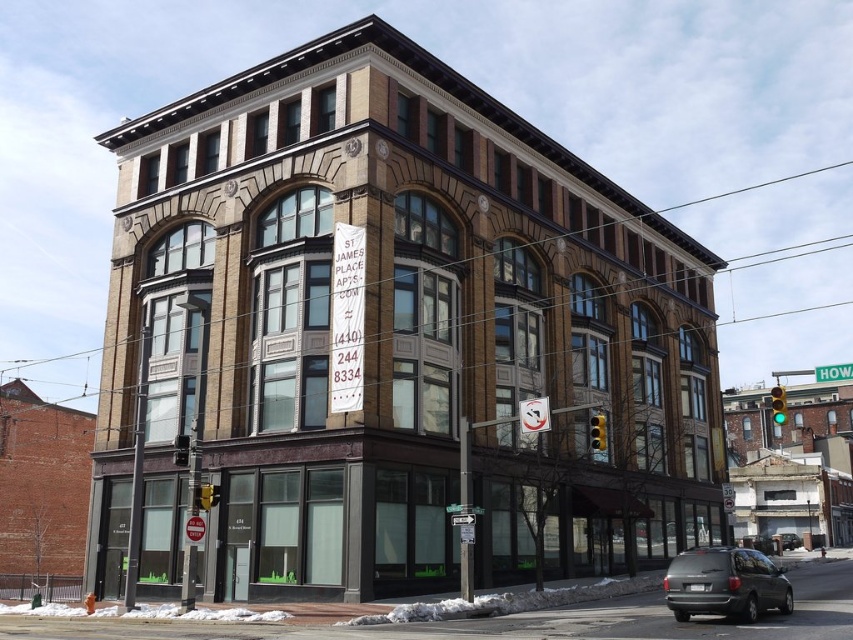
Between matte gray minivan at lower right and black matte van at center, which one is positioned lower?

black matte van at center

Which is in front, point (761, 572) or point (798, 540)?

Point (761, 572) is more forward.

Find the location of a particular element. This screenshot has height=640, width=853. matte gray minivan at lower right is located at coordinates (724, 582).

Locate an element on the screen. This screenshot has height=640, width=853. matte gray minivan at lower right is located at coordinates (724, 582).